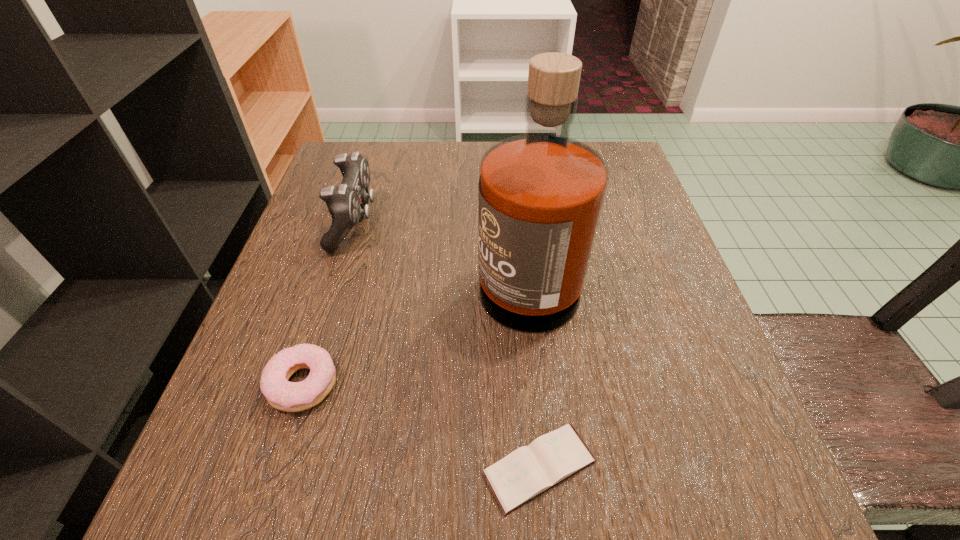
The image size is (960, 540). What are the coordinates of `liquor` in the screenshot? It's located at (540, 195).

Identify the location of the second tallest object. This screenshot has height=540, width=960. (346, 202).

This screenshot has height=540, width=960. Find the location of `doughnut`. doughnut is located at coordinates point(281,394).

Find the location of `the second nearest object`. the second nearest object is located at coordinates (281, 394).

At what (x,y) coordinates should I click in order to perform the action: click on the nearest object. Please return your answer as a coordinate pair (x, y). Looking at the image, I should click on [x=527, y=472].

Locate an element on the screen. This screenshot has height=540, width=960. the shortest object is located at coordinates click(x=527, y=472).

At what (x,y) coordinates should I click in order to perform the action: click on vacant area located 0.180m on the front label of the tallest object. Please return your answer as a coordinate pair (x, y). The image size is (960, 540). Looking at the image, I should click on (381, 267).

Find the location of a particular element. free space located 0.100m on the front label of the tallest object is located at coordinates (424, 267).

Locate an element on the screen. free space located 0.190m on the front label of the tallest object is located at coordinates (376, 267).

What are the coordinates of `vacant space located 0.190m on the surface of the second tallest object with buttons` in the screenshot? It's located at (468, 222).